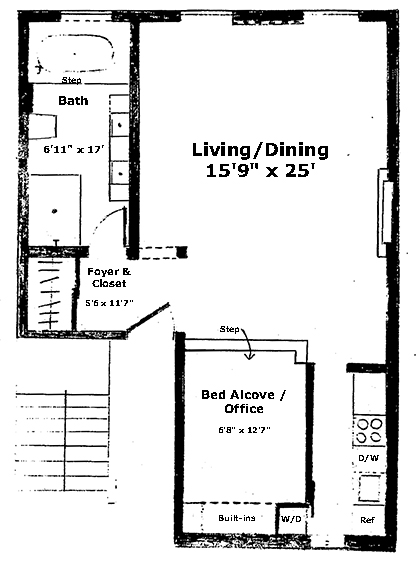
The width and height of the screenshot is (420, 562). In order to click on house plan in this screenshot , I will do `click(262, 426)`.